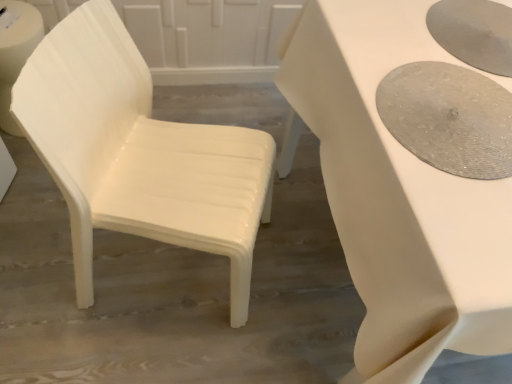
Question: Considering the positions of white plastic chair at left and white glossy table at center in the image, is white plastic chair at left bigger or smaller than white glossy table at center?

Choices:
 (A) big
 (B) small

Answer: (B)

Question: Relative to white glossy table at center, is white plastic chair at left in front or behind?

Choices:
 (A) front
 (B) behind

Answer: (B)

Question: Estimate the real-world distances between objects in this image. Which object is closer to the matte silver tray at right?

Choices:
 (A) white plastic chair at left
 (B) white glossy table at center

Answer: (B)

Question: Which object is the farthest from the white glossy table at center?

Choices:
 (A) matte silver tray at right
 (B) white plastic chair at left

Answer: (B)